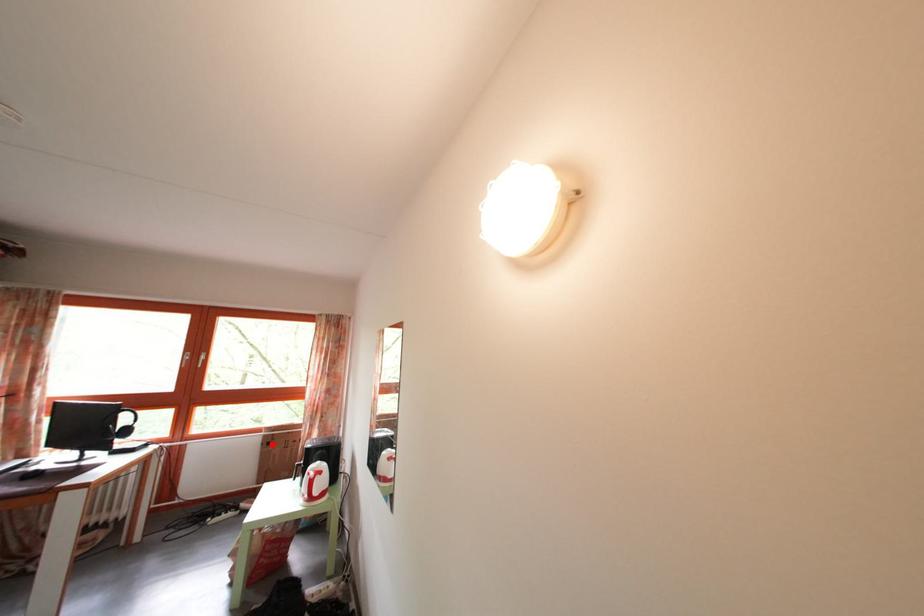
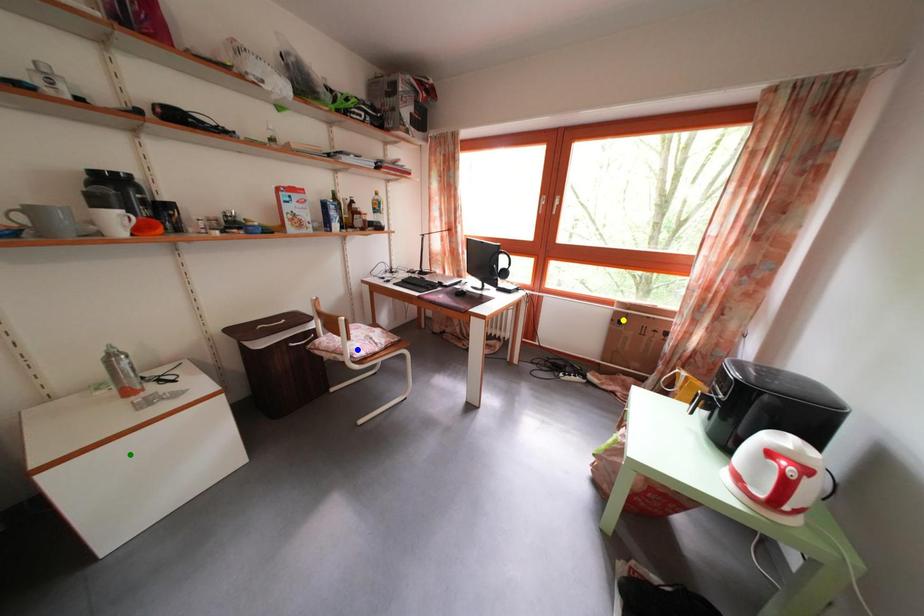
Question: I am providing you with two images of the same scene from different viewpoints. A red point is marked on the first image. You are given multiple points on the second image. Which mark in image 2 goes with the point in image 1?

Choices:
 (A) blue point
 (B) green point
 (C) yellow point

Answer: (C)